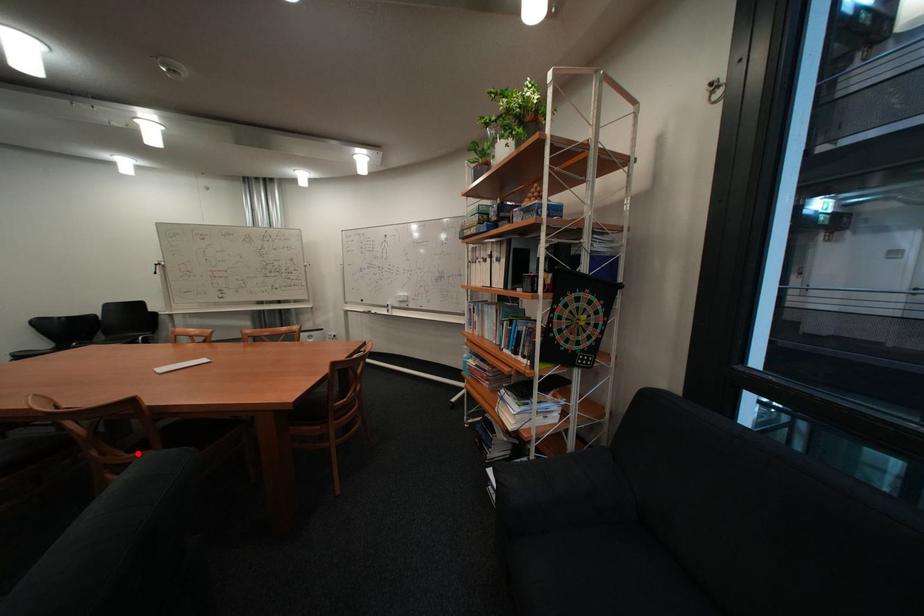
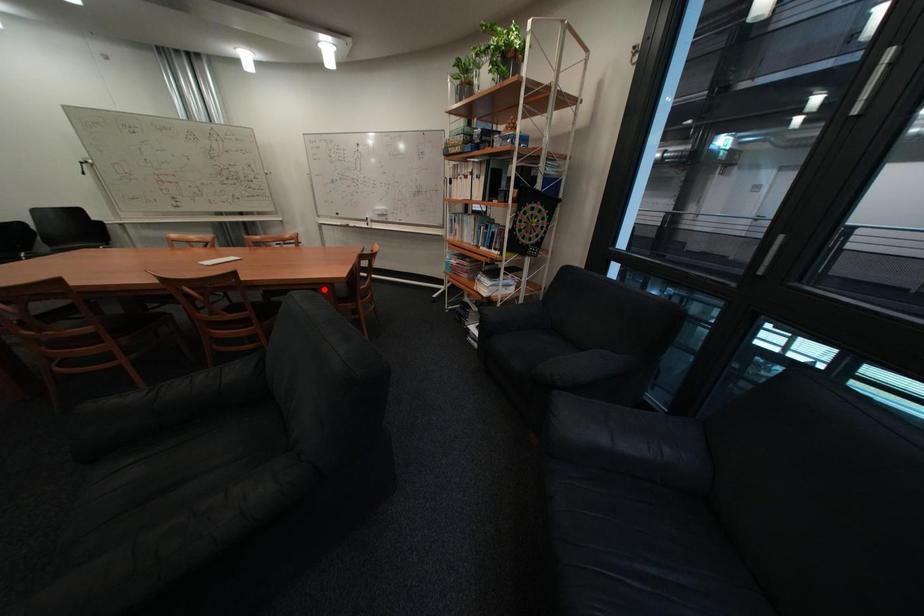
I am providing you with two images of the same scene from different viewpoints. A red point is marked on the first image and another point is marked on the second image. Do the highlighted points in image1 and image2 indicate the same real-world spot?

No